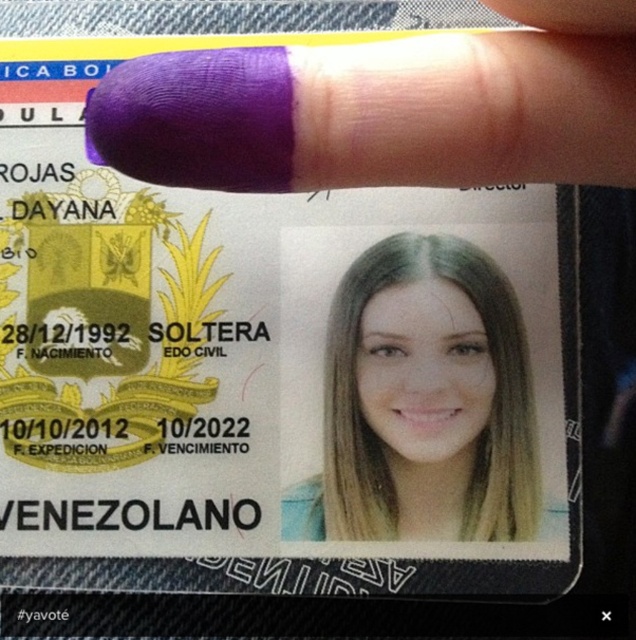
Question: Is purple matte nail at upper center smaller than blonde hair at center?

Choices:
 (A) yes
 (B) no

Answer: (B)

Question: Can you confirm if purple matte nail at upper center is positioned below blonde hair at center?

Choices:
 (A) yes
 (B) no

Answer: (B)

Question: Does purple matte nail at upper center appear under blonde hair at center?

Choices:
 (A) yes
 (B) no

Answer: (B)

Question: Which point is farther to the camera?

Choices:
 (A) purple matte nail at upper center
 (B) blonde hair at center

Answer: (B)

Question: Which point is farther to the camera?

Choices:
 (A) blonde hair at center
 (B) purple matte nail at upper center

Answer: (A)

Question: Which object appears farthest from the camera in this image?

Choices:
 (A) purple matte nail at upper center
 (B) blonde hair at center

Answer: (B)